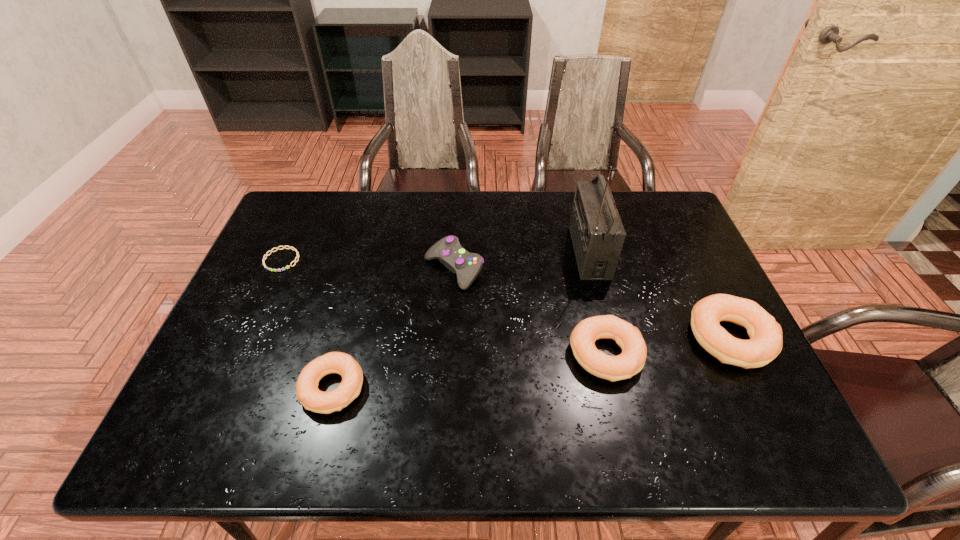
Identify the location of the second object from left to right. The height and width of the screenshot is (540, 960). (307, 392).

I want to click on the fifth tallest object, so tap(307, 392).

You are a GUI agent. You are given a task and a screenshot of the screen. Output one action in this format:
    pyautogui.click(x=<x>, y=<y>)
    Task: Click on the second tallest bagel
    This screenshot has width=960, height=540.
    Given the screenshot: What is the action you would take?
    pyautogui.click(x=631, y=361)

Identify the location of the rightmost bagel. (765, 343).

At what (x,y) coordinates should I click in order to perform the action: click on the third object from left to right. Please return your answer as a coordinate pair (x, y). This screenshot has height=540, width=960. Looking at the image, I should click on (448, 251).

The height and width of the screenshot is (540, 960). I want to click on radio receiver, so click(597, 232).

Locate an element on the screen. The height and width of the screenshot is (540, 960). bracelet is located at coordinates (290, 247).

Locate an element on the screen. Image resolution: width=960 pixels, height=540 pixels. the leftmost object is located at coordinates (290, 247).

Where is `free region located 0.330m on the back of the fifth tallest object`? free region located 0.330m on the back of the fifth tallest object is located at coordinates (365, 265).

The width and height of the screenshot is (960, 540). What are the coordinates of `vacant point located on the back of the second bagel from left to right` in the screenshot? It's located at (587, 271).